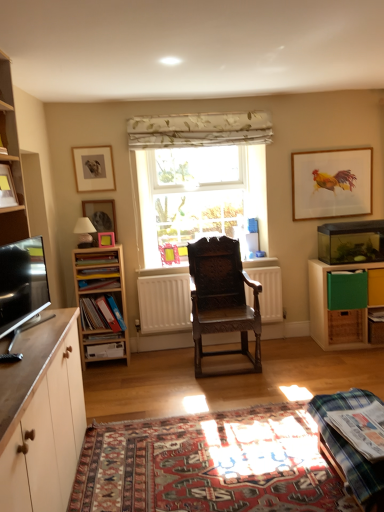
Question: Considering the positions of white matte cabinet at lower left, the 1th cabinetry positioned from the left, and matte wooden picture frame at upper left, marked as the first picture frame in a left-to-right arrangement, in the image, is white matte cabinet at lower left, the 1th cabinetry positioned from the left, wider or thinner than matte wooden picture frame at upper left, marked as the first picture frame in a left-to-right arrangement,?

Choices:
 (A) thin
 (B) wide

Answer: (B)

Question: Is white matte cabinet at lower left, the 2th cabinetry positioned from the back, inside the boundaries of matte wooden picture frame at upper left, which is the 4th picture frame in right-to-left order, or outside?

Choices:
 (A) inside
 (B) outside

Answer: (B)

Question: Which is nearer to the matte plastic book at center-left, arranged as the 2th book when viewed from the top?

Choices:
 (A) wooden drawer at right, which ranks as the second drawer in right-to-left order
 (B) white wood shelf at left, marked as the third shelf in a right-to-left arrangement
 (C) white floral fabric at center
 (D) matte wooden picture frame at center, the 1th picture frame viewed from the front
 (E) green cardboard book at center-right, the 1th book viewed from the right

Answer: (D)

Question: Which of these objects is positioned farthest from the matte black lampshade at upper left?

Choices:
 (A) white matte radiator at center
 (B) matte plastic book at center-left, marked as the 5th book in a right-to-left arrangement
 (C) green cardboard box at right, arranged as the first shelf when viewed from the right
 (D) pink plastic picture frame at left, placed as the 3th picture frame when sorted from front to back
 (E) green plastic drawer at right, which ranks as the 2th drawer in bottom-to-top order

Answer: (E)